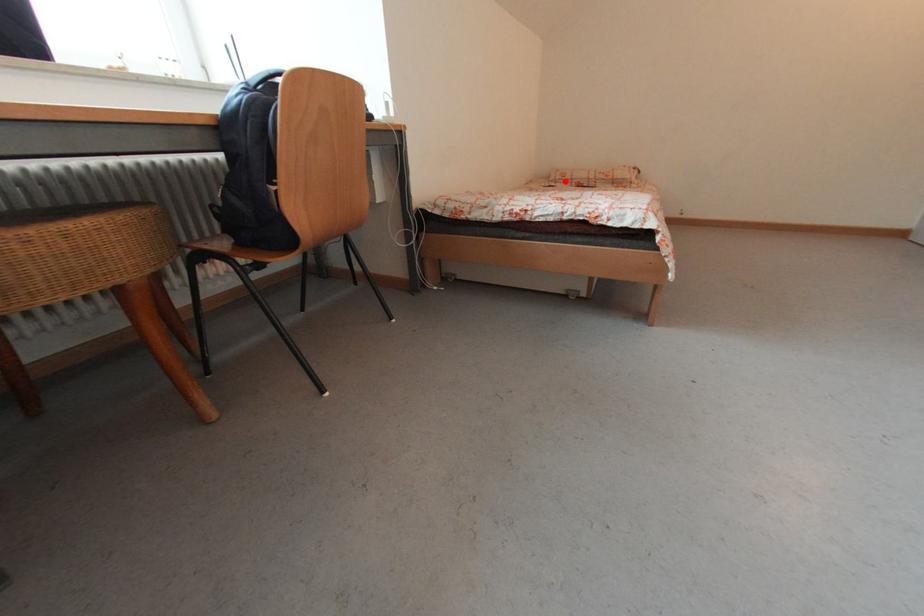
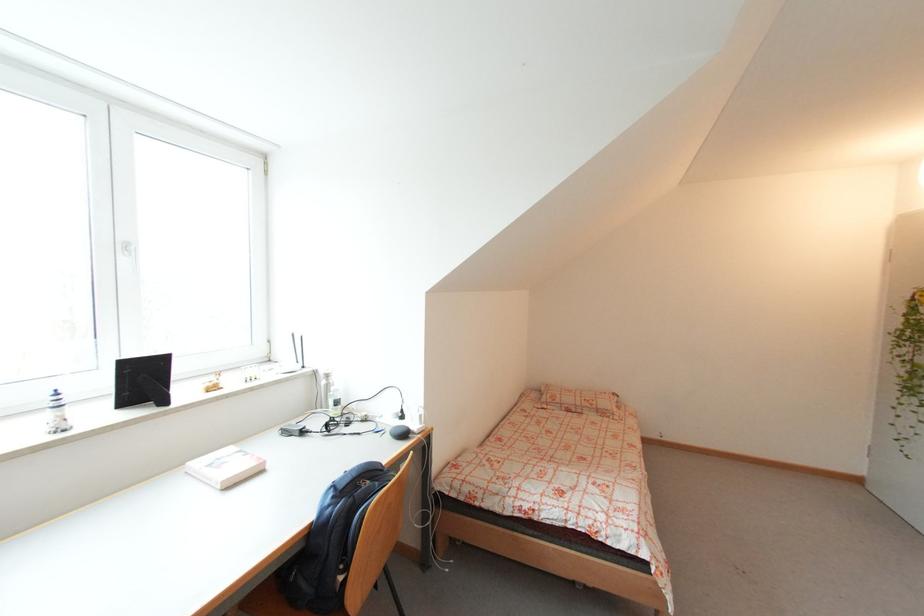
Find the pixel in the second image that matches the highlighted location in the first image.

(555, 405)